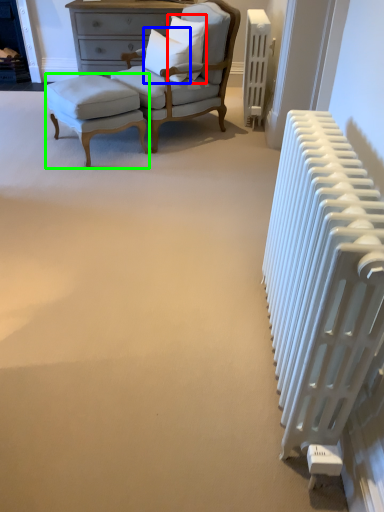
Question: Which is farther away from pillow (highlighted by a red box)? pillow (highlighted by a blue box) or stool (highlighted by a green box)?

Choices:
 (A) pillow
 (B) stool

Answer: (B)